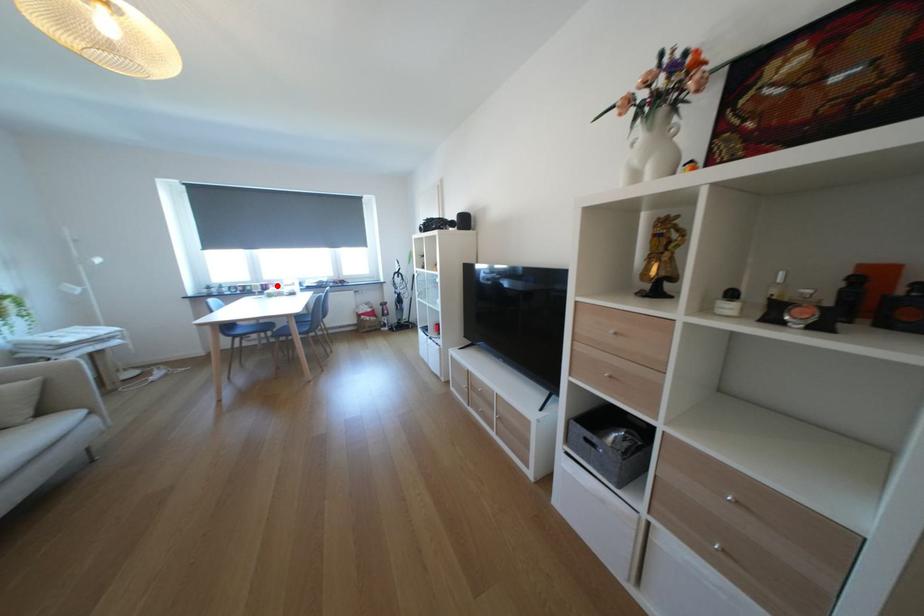
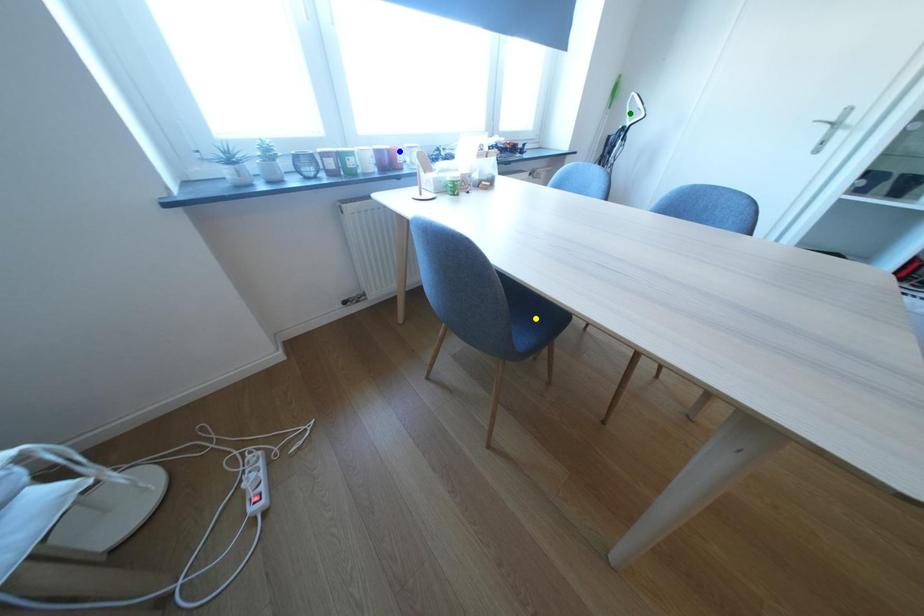
Question: I am providing you with two images of the same scene from different viewpoints. A red point is marked on the first image. You are given multiple points on the second image. Which point in image 2 is actually the same real-world point as the red point in image 1?

Choices:
 (A) green point
 (B) blue point
 (C) yellow point

Answer: (B)